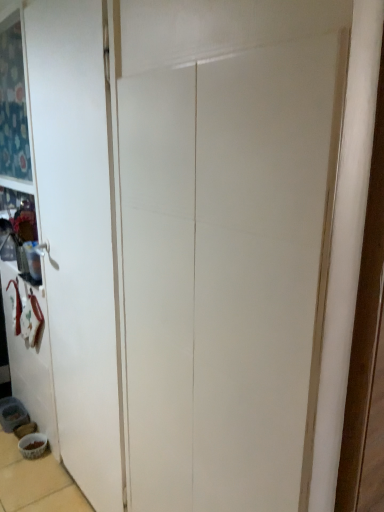
The width and height of the screenshot is (384, 512). What are the coordinates of `vacant area to the left of white glossy bowl at lower left` in the screenshot? It's located at (9, 450).